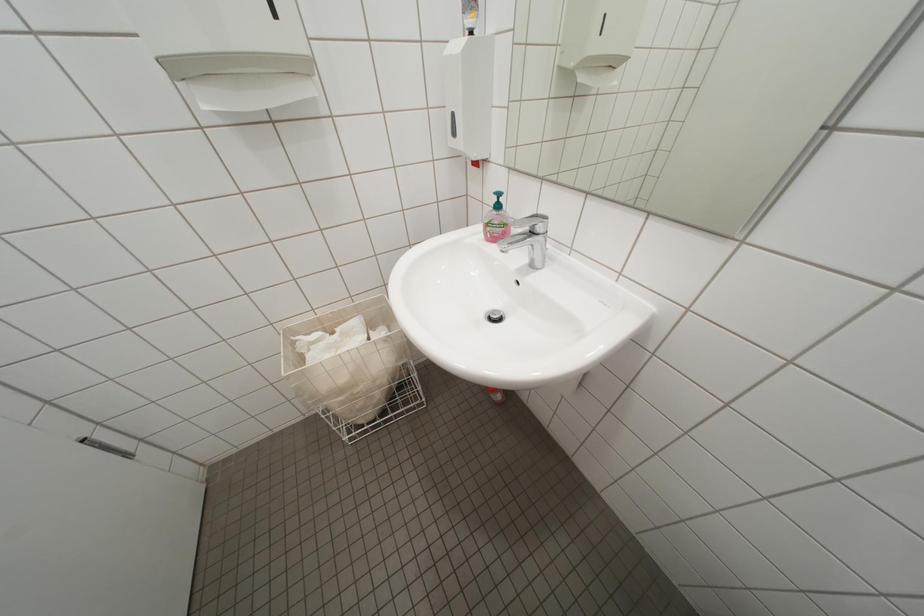
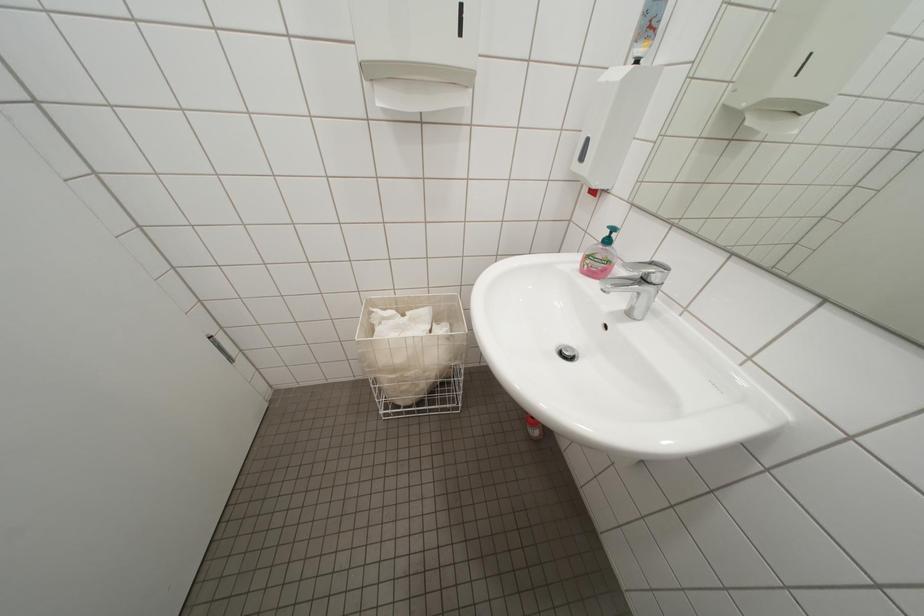
Question: In a continuous first-person perspective shot, in which direction is the camera moving?

Choices:
 (A) Left
 (B) Right
 (C) Forward
 (D) Backward

Answer: (A)